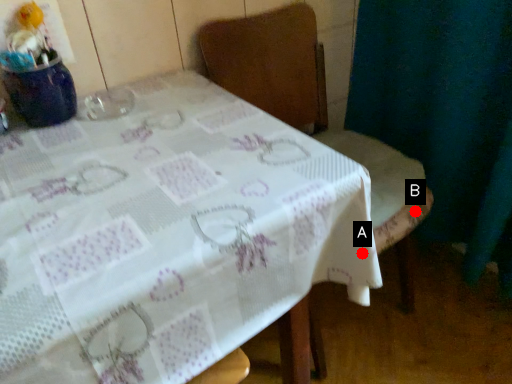
Question: Two points are circled on the image, labeled by A and B beside each circle. Among these points, which one is nearest to the camera?

Choices:
 (A) A is closer
 (B) B is closer

Answer: (A)